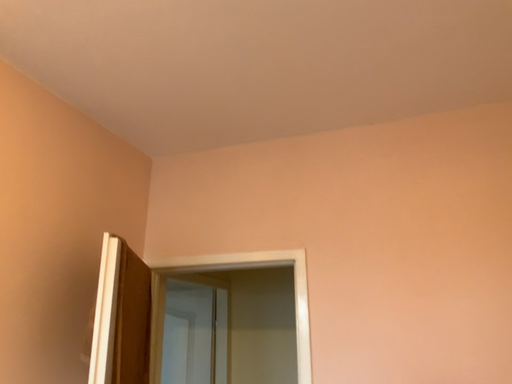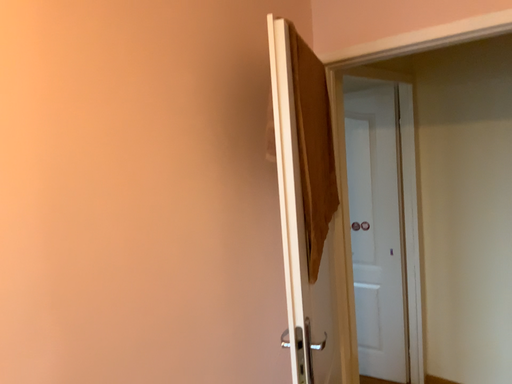
Question: How did the camera likely rotate when shooting the video?

Choices:
 (A) rotated upward
 (B) rotated downward

Answer: (B)